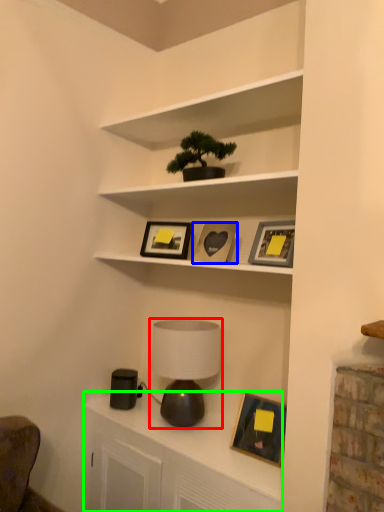
Question: Which object is the farthest from table lamp (highlighted by a red box)? Choose among these: picture frame (highlighted by a blue box) or dresser (highlighted by a green box).

Choices:
 (A) picture frame
 (B) dresser

Answer: (A)